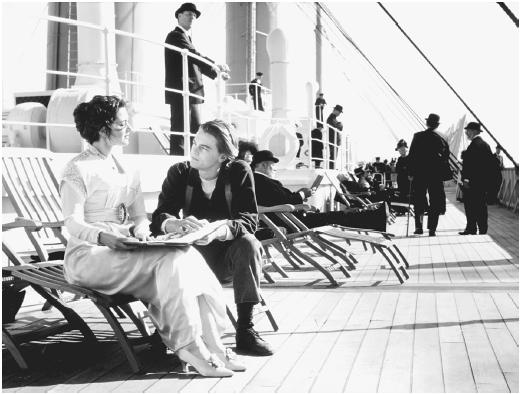
This screenshot has width=520, height=394. Identify the location of chairs. (35, 270), (35, 175), (339, 231).